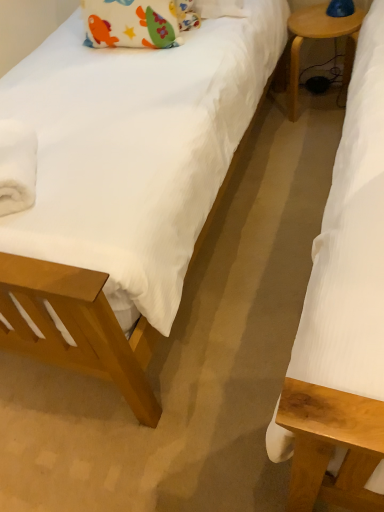
Question: Could you tell me if soft cotton pillow at upper left is turned towards wooden side table at right?

Choices:
 (A) no
 (B) yes

Answer: (A)

Question: From a real-world perspective, is soft cotton pillow at upper left physically below wooden side table at right?

Choices:
 (A) no
 (B) yes

Answer: (A)

Question: Is soft cotton pillow at upper left far away from wooden side table at right?

Choices:
 (A) no
 (B) yes

Answer: (A)

Question: From the image's perspective, is soft cotton pillow at upper left beneath wooden side table at right?

Choices:
 (A) no
 (B) yes

Answer: (B)

Question: Is soft cotton pillow at upper left bigger than wooden side table at right?

Choices:
 (A) yes
 (B) no

Answer: (B)

Question: From a real-world perspective, relative to white fluffy towel at left, is wooden side table at right vertically above or below?

Choices:
 (A) above
 (B) below

Answer: (B)

Question: Is point (352, 29) positioned closer to the camera than point (21, 180)?

Choices:
 (A) closer
 (B) farther

Answer: (B)

Question: From the image's perspective, is wooden side table at right above or below white fluffy towel at left?

Choices:
 (A) above
 (B) below

Answer: (A)

Question: Considering the positions of wooden side table at right and white fluffy towel at left in the image, is wooden side table at right wider or thinner than white fluffy towel at left?

Choices:
 (A) thin
 (B) wide

Answer: (A)

Question: Looking at their shapes, would you say white fluffy towel at left is wider or thinner than soft cotton pillow at upper left?

Choices:
 (A) wide
 (B) thin

Answer: (A)

Question: Relative to soft cotton pillow at upper left, is white fluffy towel at left in front or behind?

Choices:
 (A) behind
 (B) front

Answer: (B)

Question: Considering the positions of point (34, 196) and point (172, 13), is point (34, 196) closer or farther from the camera than point (172, 13)?

Choices:
 (A) farther
 (B) closer

Answer: (B)

Question: Would you say white fluffy towel at left is to the left or to the right of soft cotton pillow at upper left in the picture?

Choices:
 (A) right
 (B) left

Answer: (B)

Question: Is soft cotton pillow at upper left to the left or to the right of wooden side table at right in the image?

Choices:
 (A) left
 (B) right

Answer: (A)

Question: In terms of size, does soft cotton pillow at upper left appear bigger or smaller than wooden side table at right?

Choices:
 (A) big
 (B) small

Answer: (B)